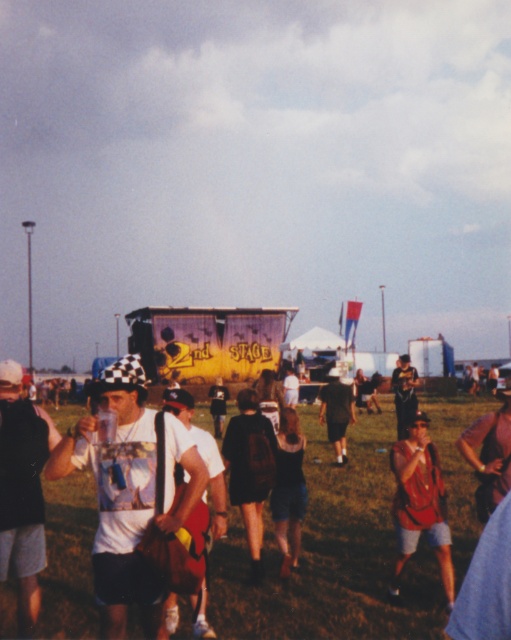
Can you confirm if white matte t-shirt at center is shorter than matte red shirt at center?

Yes.

Can you confirm if white matte t-shirt at center is smaller than matte red shirt at center?

Yes.

Locate an element on the screen. This screenshot has height=640, width=511. white matte t-shirt at center is located at coordinates (128, 492).

At what (x,y) coordinates should I click in order to perform the action: click on white matte t-shirt at center. Please return your answer as a coordinate pair (x, y). The width and height of the screenshot is (511, 640). Looking at the image, I should click on (128, 492).

Who is taller, matte red shirt at center or dark green shorts at center?

Standing taller between the two is dark green shorts at center.

Is matte red shirt at center thinner than dark green shorts at center?

Yes, matte red shirt at center is thinner than dark green shorts at center.

Identify the location of matte red shirt at center. This screenshot has width=511, height=640. (420, 502).

Is matte red shirt at center thinner than dark brown backpack at center?

Incorrect, matte red shirt at center's width is not less than dark brown backpack at center's.

Is matte red shirt at center below dark brown backpack at center?

Yes.

This screenshot has width=511, height=640. I want to click on matte red shirt at center, so click(420, 502).

At what (x,y) coordinates should I click in order to perform the action: click on matte red shirt at center. Please return your answer as a coordinate pair (x, y). The height and width of the screenshot is (640, 511). Looking at the image, I should click on (420, 502).